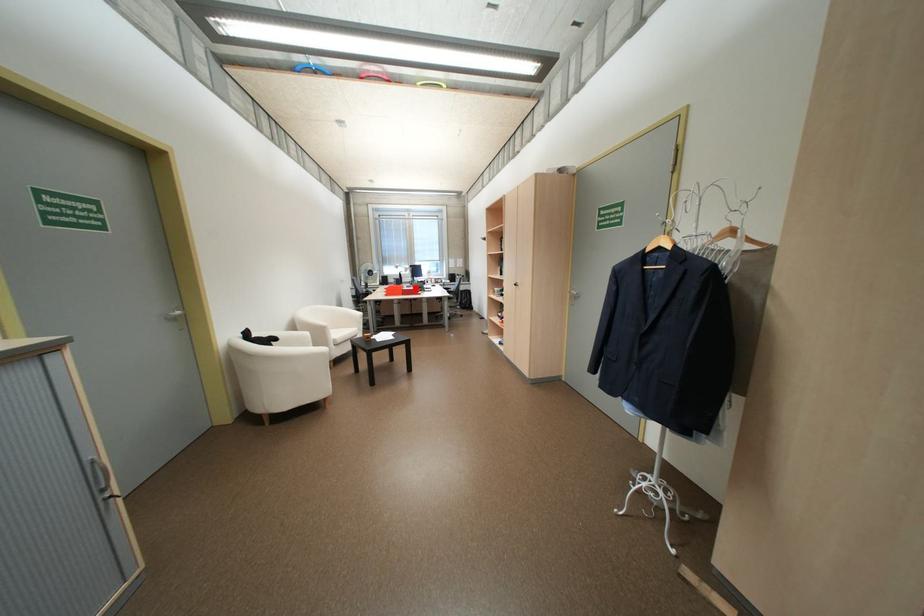
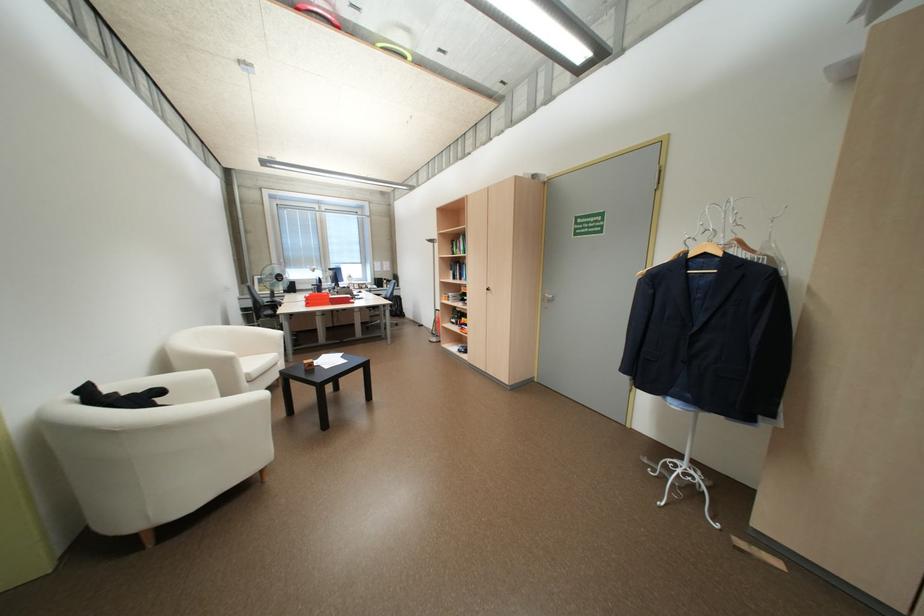
The point at the highlighted location is marked in the first image. Where is the corresponding point in the second image?

(342, 296)